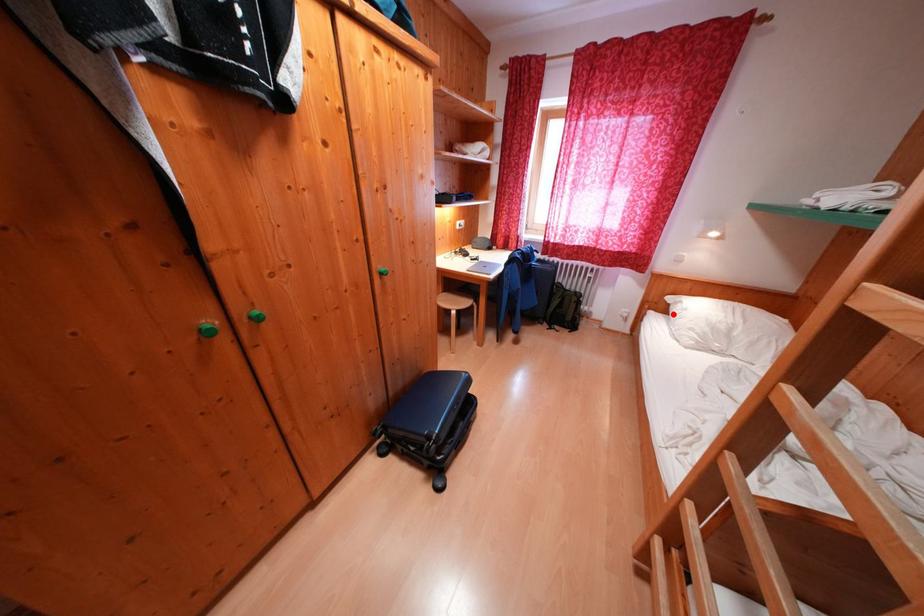
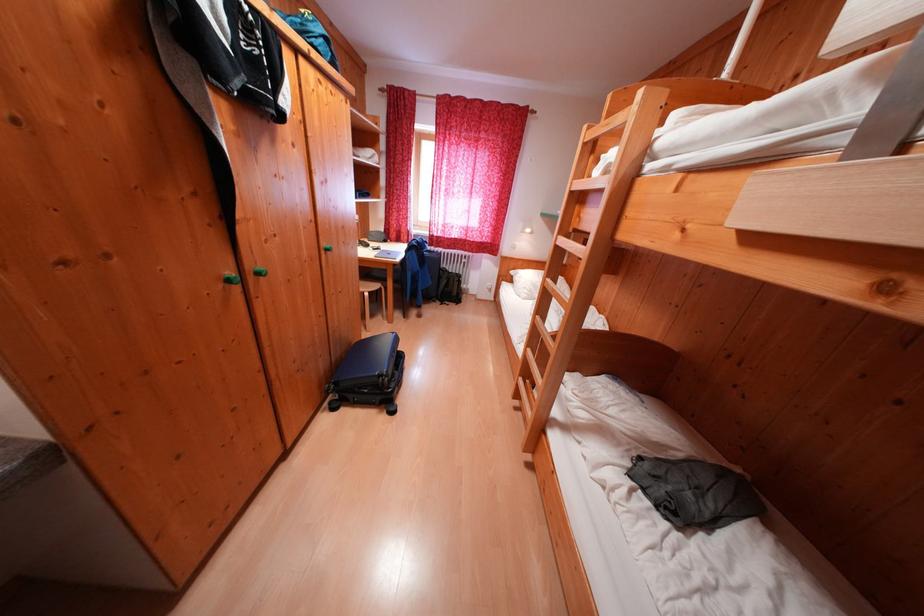
In the second image, find the point that corresponds to the highlighted location in the first image.

(518, 284)